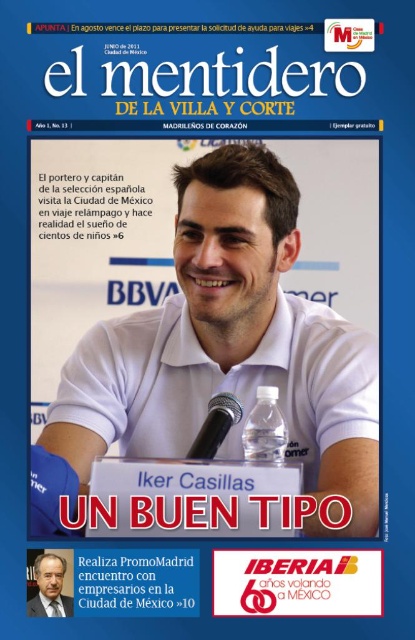
Question: Is white matte polo shirt at center positioned at the back of clear plastic water bottle at center?

Choices:
 (A) yes
 (B) no

Answer: (A)

Question: Which object appears closest to the camera in this image?

Choices:
 (A) clear plastic water bottle at center
 (B) white matte polo shirt at center
 (C) black plastic microphone at center

Answer: (C)

Question: Which point is closer to the camera?

Choices:
 (A) white matte polo shirt at center
 (B) clear plastic water bottle at center

Answer: (B)

Question: Which point is closer to the camera?

Choices:
 (A) matte white shirt at center
 (B) clear plastic water bottle at center

Answer: (A)

Question: Is white matte polo shirt at center positioned in front of clear plastic water bottle at center?

Choices:
 (A) yes
 (B) no

Answer: (B)

Question: Does white matte polo shirt at center appear on the right side of black plastic microphone at center?

Choices:
 (A) no
 (B) yes

Answer: (B)